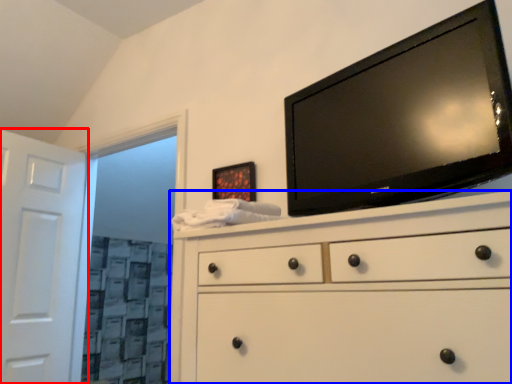
Question: Which object appears farthest to the camera in this image, door (highlighted by a red box) or chest of drawers (highlighted by a blue box)?

Choices:
 (A) door
 (B) chest of drawers

Answer: (A)